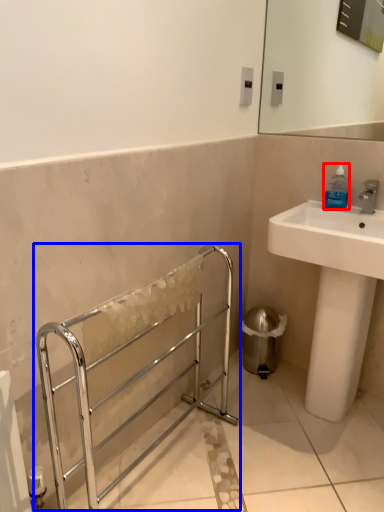
Question: Which point is closer to the camera, bottle (highlighted by a red box) or balustrade (highlighted by a blue box)?

Choices:
 (A) bottle
 (B) balustrade

Answer: (B)